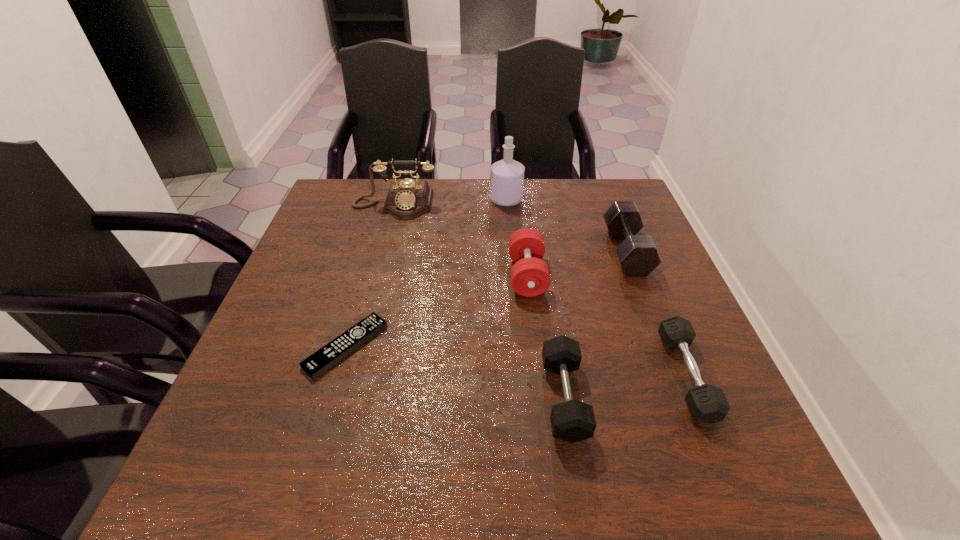
Identify the location of perfume. click(507, 176).

Locate an element on the screen. The height and width of the screenshot is (540, 960). the sixth shortest object is located at coordinates (407, 199).

Identify the location of the shortest dumbbell. This screenshot has height=540, width=960. (707, 403).

This screenshot has height=540, width=960. Find the location of `the shortest object`. the shortest object is located at coordinates (316, 364).

Locate an element on the screen. vacant space situated 0.120m on the left of the tallest object is located at coordinates (450, 200).

You are a GUI agent. You are given a task and a screenshot of the screen. Output one action in this format:
    pyautogui.click(x=<x>, y=<y>)
    Task: Click on the free space located 0.250m on the dial of the sixth shortest object
    The height and width of the screenshot is (540, 960).
    Given the screenshot: What is the action you would take?
    pyautogui.click(x=375, y=280)

Where is `free space located on the left of the shortest dumbbell`? free space located on the left of the shortest dumbbell is located at coordinates (559, 375).

I want to click on vacant space located on the front of the remote control, so click(320, 438).

The image size is (960, 540). Identify the location of perfume that is positioned at the far edge. (507, 176).

Where is `telephone that is at the far edge`? The width and height of the screenshot is (960, 540). telephone that is at the far edge is located at coordinates (407, 199).